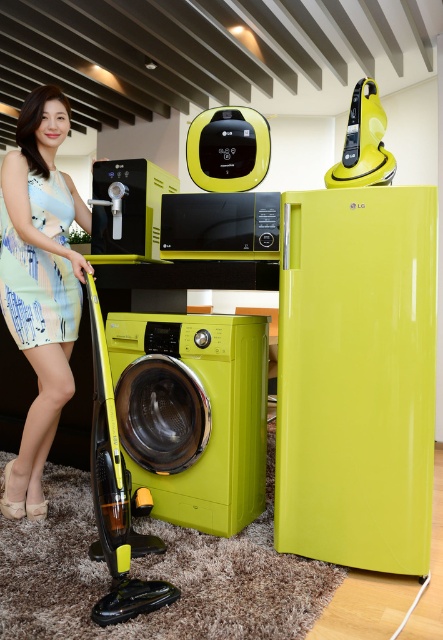
Question: Estimate the real-world distances between objects in this image. Which object is closer to the printed fabric dress at left?

Choices:
 (A) matte black water dispenser at center
 (B) matte blue dress at center

Answer: (B)

Question: Where is matte yellow washing machine at center located in relation to printed fabric dress at left in the image?

Choices:
 (A) below
 (B) above

Answer: (A)

Question: Among these objects, which one is farthest from the camera?

Choices:
 (A) matte yellow washing machine at center
 (B) printed fabric dress at left
 (C) matte black water dispenser at center
 (D) matte blue dress at center

Answer: (C)

Question: Estimate the real-world distances between objects in this image. Which object is farther from the matte black water dispenser at center?

Choices:
 (A) matte yellow washing machine at center
 (B) matte blue dress at center
 (C) printed fabric dress at left

Answer: (A)

Question: Does matte yellow washing machine at center appear over matte blue dress at center?

Choices:
 (A) no
 (B) yes

Answer: (A)

Question: Where is printed fabric dress at left located in relation to matte black water dispenser at center in the image?

Choices:
 (A) left
 (B) right

Answer: (A)